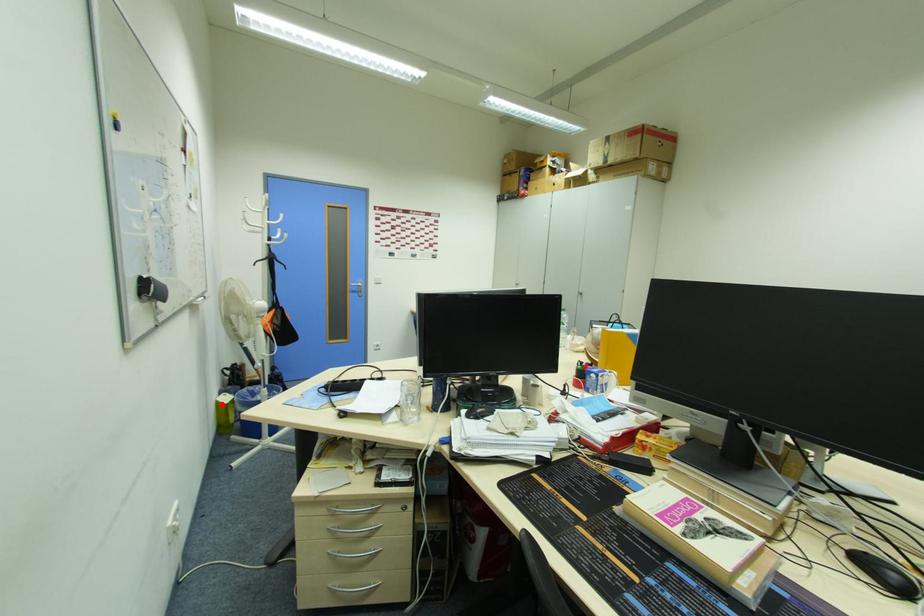
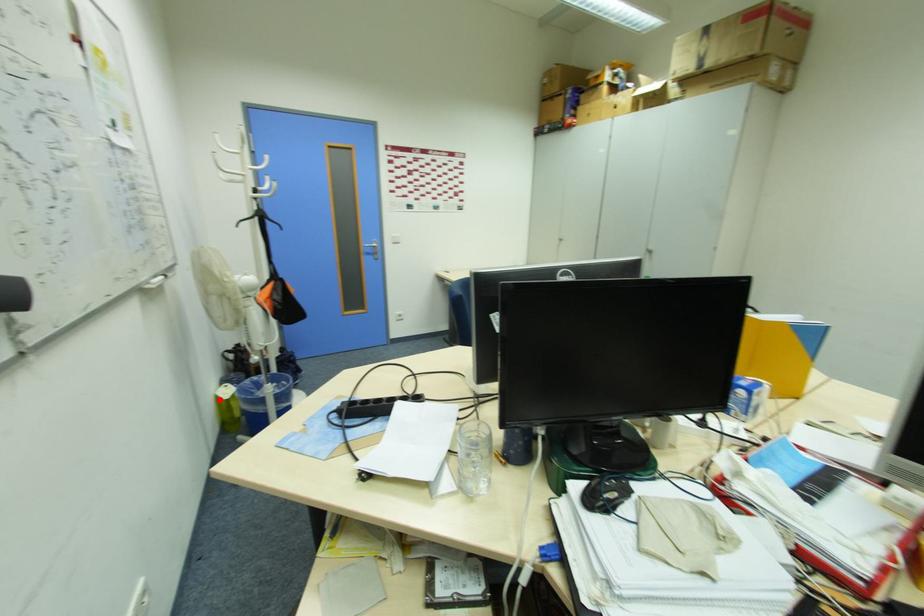
In the scene shown: I am providing you with two images of the same scene from different viewpoints. A red point is marked on the first image and another point is marked on the second image. Is the red point in image1 aligned with the point shown in image2?

Yes